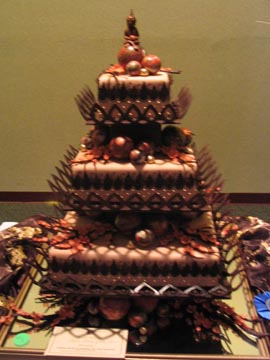
This screenshot has height=360, width=270. Find the location of `brown baseboard`. brown baseboard is located at coordinates (249, 199), (24, 195).